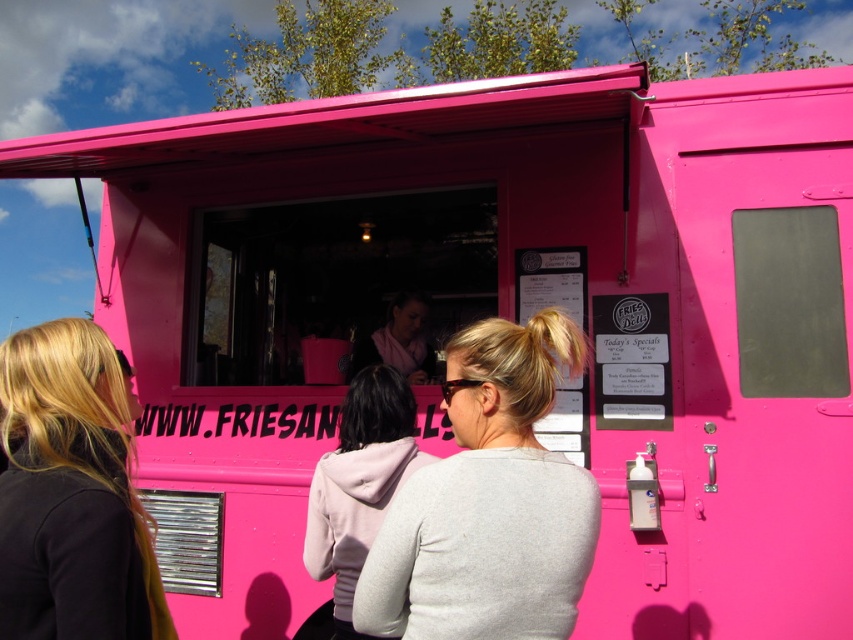
Is matte gray sweater at center positioned in front of pink fleece hoodie at center?

Yes, it is.

Between matte gray sweater at center and pink fleece hoodie at center, which one is positioned lower?

Positioned lower is pink fleece hoodie at center.

What do you see at coordinates (488, 502) in the screenshot? This screenshot has width=853, height=640. I see `matte gray sweater at center` at bounding box center [488, 502].

Where is `matte gray sweater at center`? This screenshot has width=853, height=640. matte gray sweater at center is located at coordinates (488, 502).

Can you confirm if matte gray sweater at center is positioned below black matte hair at left?

Yes.

Is point (405, 490) farther from camera compared to point (126, 579)?

Yes, point (405, 490) is farther from viewer.

In order to click on matte gray sweater at center in this screenshot , I will do `click(488, 502)`.

Does point (103, 499) lie in front of point (364, 424)?

Yes.

Is black matte hair at left wider than pink fleece hoodie at center?

Incorrect, black matte hair at left's width does not surpass pink fleece hoodie at center's.

Who is more distant from viewer, (103, 333) or (346, 637)?

Positioned behind is point (346, 637).

At what (x,y) coordinates should I click in order to perform the action: click on black matte hair at left. Please return your answer as a coordinate pair (x, y). Looking at the image, I should click on (71, 493).